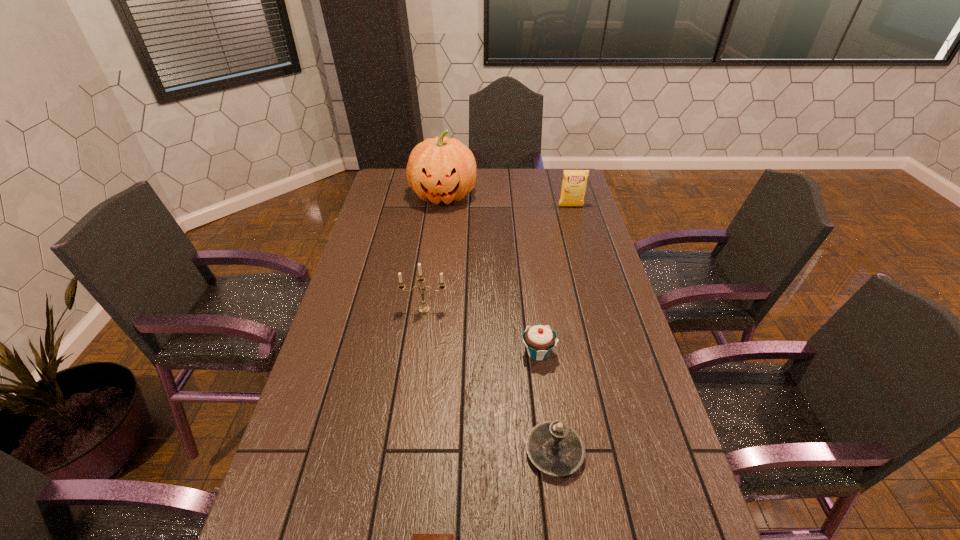
You are a GUI agent. You are given a task and a screenshot of the screen. Output one action in this format:
    pyautogui.click(x=<x>, y=<y>)
    Task: Click on the blank area in the image that satisfies the following two spatial constraints: 1. on the front side of the cupcake; 2. on the left side of the nearer candle
    Image resolution: width=960 pixels, height=540 pixels.
    Given the screenshot: What is the action you would take?
    pyautogui.click(x=550, y=451)

The image size is (960, 540). In order to click on free location that satisfies the following two spatial constraints: 1. on the carved face of the fourth farthest object; 2. on the right side of the tallest object in this screenshot , I will do [424, 353].